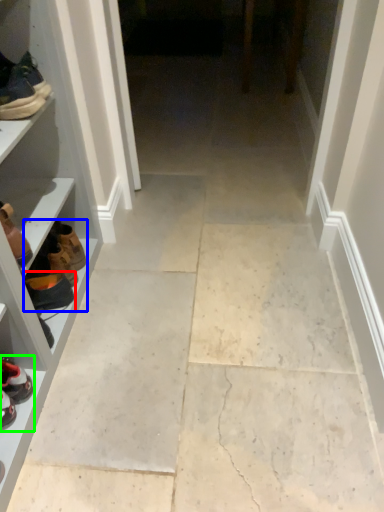
Question: Estimate the real-world distances between objects in this image. Which object is closer to footwear (highlighted by a red box), shoe (highlighted by a blue box) or footwear (highlighted by a green box)?

Choices:
 (A) shoe
 (B) footwear

Answer: (A)